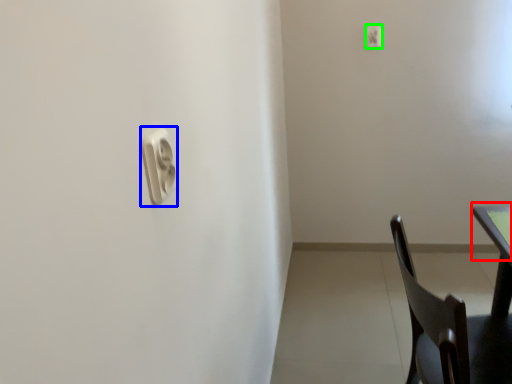
Question: Considering the real-world distances, which object is farthest from table top (highlighted by a red box)? light switch (highlighted by a blue box) or light switch (highlighted by a green box)?

Choices:
 (A) light switch
 (B) light switch

Answer: (B)